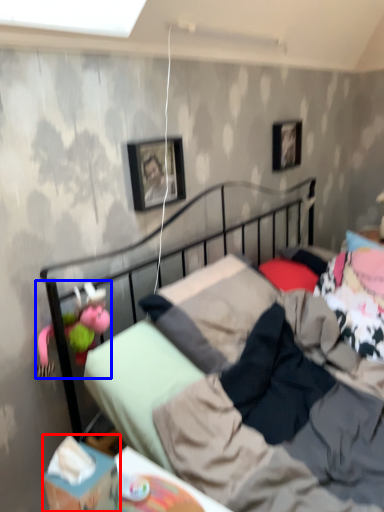
Question: Which object appears farthest to the camera in this image, box (highlighted by a red box) or doll (highlighted by a blue box)?

Choices:
 (A) box
 (B) doll

Answer: (B)